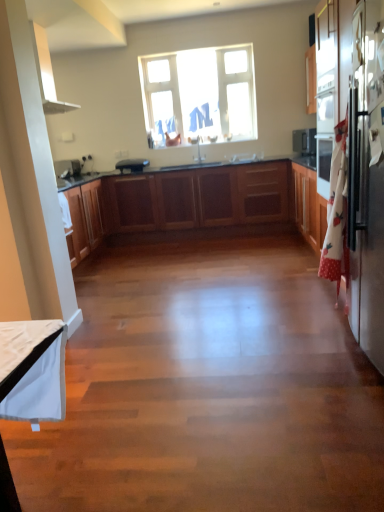
Question: Is clear glass window at upper center at the left side of sleek stainless steel refrigerator at right?

Choices:
 (A) yes
 (B) no

Answer: (A)

Question: Is clear glass window at upper center oriented towards sleek stainless steel refrigerator at right?

Choices:
 (A) no
 (B) yes

Answer: (B)

Question: From a real-world perspective, is clear glass window at upper center physically above sleek stainless steel refrigerator at right?

Choices:
 (A) no
 (B) yes

Answer: (B)

Question: Is clear glass window at upper center completely or partially outside of sleek stainless steel refrigerator at right?

Choices:
 (A) no
 (B) yes

Answer: (B)

Question: Is clear glass window at upper center in front of sleek stainless steel refrigerator at right?

Choices:
 (A) no
 (B) yes

Answer: (A)

Question: In terms of height, does white glossy sink at center look taller or shorter compared to wooden cabinets at center?

Choices:
 (A) short
 (B) tall

Answer: (A)

Question: Is white glossy sink at center bigger or smaller than wooden cabinets at center?

Choices:
 (A) small
 (B) big

Answer: (A)

Question: Would you say white glossy sink at center is to the left or to the right of wooden cabinets at center in the picture?

Choices:
 (A) left
 (B) right

Answer: (B)

Question: Considering their positions, is white glossy sink at center located in front of or behind wooden cabinets at center?

Choices:
 (A) front
 (B) behind

Answer: (B)

Question: Looking at the image, does black matte toaster at center seem bigger or smaller compared to clear glass window at upper center?

Choices:
 (A) big
 (B) small

Answer: (B)

Question: From their relative heights in the image, would you say black matte toaster at center is taller or shorter than clear glass window at upper center?

Choices:
 (A) tall
 (B) short

Answer: (B)

Question: Would you say black matte toaster at center is inside or outside clear glass window at upper center?

Choices:
 (A) inside
 (B) outside

Answer: (B)

Question: From the image's perspective, relative to clear glass window at upper center, is black matte toaster at center above or below?

Choices:
 (A) below
 (B) above

Answer: (A)

Question: From the image's perspective, is clear glass window at upper center above or below wooden cabinets at center?

Choices:
 (A) below
 (B) above

Answer: (B)

Question: Is clear glass window at upper center to the left or to the right of wooden cabinets at center in the image?

Choices:
 (A) right
 (B) left

Answer: (A)